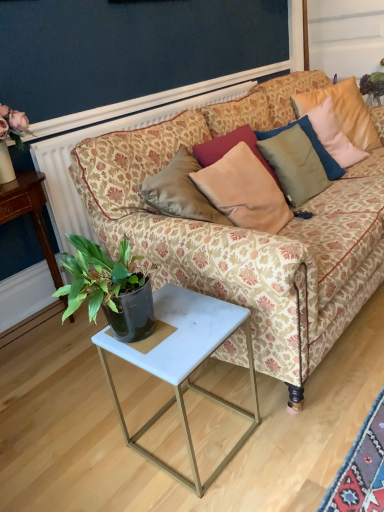
Locate an element on the screen. free space that is in between white marble table at lower left and white marble side table at lower center is located at coordinates (85, 384).